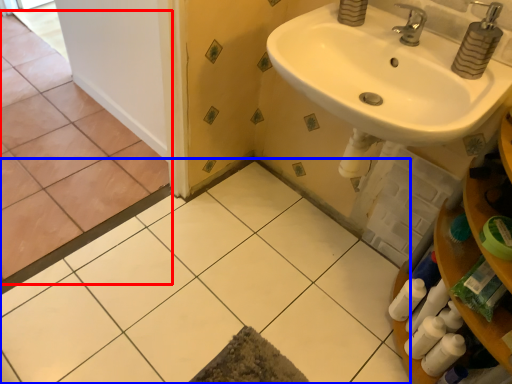
Question: Which of the following is the closest to the observer, ceramic tile (highlighted by a red box) or ceramic tile (highlighted by a blue box)?

Choices:
 (A) ceramic tile
 (B) ceramic tile

Answer: (B)